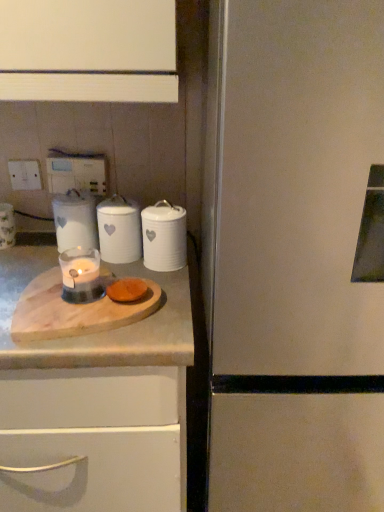
Find the location of `free space on the front side of white ceramic candle at center, which is the 1th kitchen appliance from left to right`. free space on the front side of white ceramic candle at center, which is the 1th kitchen appliance from left to right is located at coordinates (43, 268).